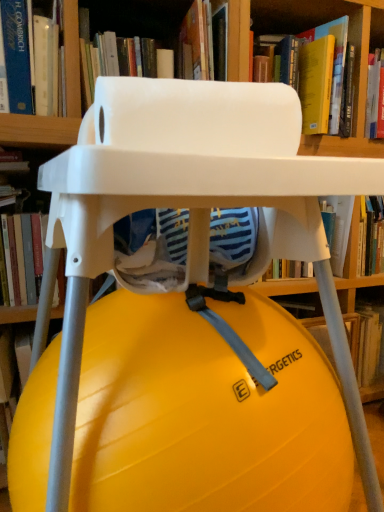
What is the approximate width of hardcover book at left, which is the first book in left-to-right order?

12.73 inches.

Where is `yellow matte exercise ball at center, the fifth book viewed from the left`? yellow matte exercise ball at center, the fifth book viewed from the left is located at coordinates (366, 344).

In order to face blue hardcover book at upper left, marked as the 4th book in a right-to-left arrangement, should I rotate leftwards or rightwards?

Rotate left and turn 21.204 degrees.

Locate an element on the screen. The height and width of the screenshot is (512, 384). blue hardcover book at upper left, which is counted as the second book, starting from the left is located at coordinates (30, 60).

What is the approximate height of yellow hardcover book at upper center, arranged as the 2th book when viewed from the right?

yellow hardcover book at upper center, arranged as the 2th book when viewed from the right, is 12.46 inches tall.

Locate an element on the screen. The height and width of the screenshot is (512, 384). hardcover book at left, which appears as the 5th book when viewed from the right is located at coordinates point(23,255).

Which point is more distant from viewer, (6, 155) or (341, 60)?

Positioned behind is point (341, 60).

Looking at their sizes, would you say hardcover book at left, which appears as the 5th book when viewed from the right, is wider or thinner than yellow hardcover book at upper center, arranged as the 2th book when viewed from the right?

Clearly, hardcover book at left, which appears as the 5th book when viewed from the right, has less width compared to yellow hardcover book at upper center, arranged as the 2th book when viewed from the right.

Considering the sizes of hardcover book at left, which appears as the 5th book when viewed from the right, and yellow hardcover book at upper center, arranged as the 2th book when viewed from the right, in the image, is hardcover book at left, which appears as the 5th book when viewed from the right, taller or shorter than yellow hardcover book at upper center, arranged as the 2th book when viewed from the right,?

hardcover book at left, which appears as the 5th book when viewed from the right, is shorter than yellow hardcover book at upper center, arranged as the 2th book when viewed from the right.

Consider the image. Is white matte book at upper center, the third book in the right-to-left sequence, taller than yellow rubber ball at center?

No, white matte book at upper center, the third book in the right-to-left sequence, is not taller than yellow rubber ball at center.

Find the location of a particular element. The height and width of the screenshot is (512, 384). ball located underneath the white matte book at upper center, which ranks as the 3th book in left-to-right order (from a real-world perspective) is located at coordinates (205, 412).

Which is behind, point (90, 16) or point (124, 510)?

Point (90, 16)

Is hardcover book at left, which appears as the 5th book when viewed from the right, not within blue hardcover book at upper left, which is counted as the second book, starting from the left?

Absolutely, hardcover book at left, which appears as the 5th book when viewed from the right, is external to blue hardcover book at upper left, which is counted as the second book, starting from the left.

Is hardcover book at left, which is the first book in left-to-right order, next to blue hardcover book at upper left, which is counted as the second book, starting from the left?

No, hardcover book at left, which is the first book in left-to-right order, is not with blue hardcover book at upper left, which is counted as the second book, starting from the left.

From the image's perspective, is yellow rubber ball at center above or below blue hardcover book at upper left, which is counted as the second book, starting from the left?

yellow rubber ball at center is situated lower than blue hardcover book at upper left, which is counted as the second book, starting from the left, in the image.

Does yellow rubber ball at center come in front of blue hardcover book at upper left, marked as the 4th book in a right-to-left arrangement?

Yes, yellow rubber ball at center is closer to the camera.

Could you tell me if yellow rubber ball at center is facing blue hardcover book at upper left, marked as the 4th book in a right-to-left arrangement?

No, yellow rubber ball at center is not aimed at blue hardcover book at upper left, marked as the 4th book in a right-to-left arrangement.

Is yellow rubber ball at center placed right next to blue hardcover book at upper left, which is counted as the second book, starting from the left?

yellow rubber ball at center is not next to blue hardcover book at upper left, which is counted as the second book, starting from the left, and they're not touching.

How different are the orientations of white matte book at upper center, which ranks as the 3th book in left-to-right order, and blue hardcover book at upper left, which is counted as the second book, starting from the left, in degrees?

The angular difference between white matte book at upper center, which ranks as the 3th book in left-to-right order, and blue hardcover book at upper left, which is counted as the second book, starting from the left, is 0.00073 degrees.

From a real-world perspective, relative to blue hardcover book at upper left, marked as the 4th book in a right-to-left arrangement, is white matte book at upper center, the third book in the right-to-left sequence, vertically above or below?

Clearly, from a real-world perspective, white matte book at upper center, the third book in the right-to-left sequence, is above blue hardcover book at upper left, marked as the 4th book in a right-to-left arrangement.

Is white matte book at upper center, the third book in the right-to-left sequence, aimed at blue hardcover book at upper left, which is counted as the second book, starting from the left?

No, white matte book at upper center, the third book in the right-to-left sequence, is not turned towards blue hardcover book at upper left, which is counted as the second book, starting from the left.

Considering the relative positions of yellow rubber ball at center and white matte book at upper center, which ranks as the 3th book in left-to-right order, in the image provided, is yellow rubber ball at center to the right of white matte book at upper center, which ranks as the 3th book in left-to-right order, from the viewer's perspective?

Correct, you'll find yellow rubber ball at center to the right of white matte book at upper center, which ranks as the 3th book in left-to-right order.

Would you say yellow rubber ball at center is inside or outside white matte book at upper center, which ranks as the 3th book in left-to-right order?

yellow rubber ball at center exists outside the volume of white matte book at upper center, which ranks as the 3th book in left-to-right order.

Relative to white matte book at upper center, the third book in the right-to-left sequence, is yellow rubber ball at center in front or behind?

Clearly, yellow rubber ball at center is in front of white matte book at upper center, the third book in the right-to-left sequence.

How many degrees apart are the facing directions of yellow rubber ball at center and white matte book at upper center, the third book in the right-to-left sequence?

The angular difference between yellow rubber ball at center and white matte book at upper center, the third book in the right-to-left sequence, is 90 degrees.

In the scene shown: Is white matte book at upper center, which ranks as the 3th book in left-to-right order, wider than hardcover book at left, which is the first book in left-to-right order?

Yes.

Can you confirm if white matte book at upper center, the third book in the right-to-left sequence, is smaller than hardcover book at left, which appears as the 5th book when viewed from the right?

Incorrect, white matte book at upper center, the third book in the right-to-left sequence, is not smaller in size than hardcover book at left, which appears as the 5th book when viewed from the right.

From the picture: How different are the orientations of white matte book at upper center, which ranks as the 3th book in left-to-right order, and hardcover book at left, which is the first book in left-to-right order, in degrees?

white matte book at upper center, which ranks as the 3th book in left-to-right order, and hardcover book at left, which is the first book in left-to-right order, are facing 0.000919 degrees away from each other.

In the image, is white matte book at upper center, which ranks as the 3th book in left-to-right order, positioned in front of or behind hardcover book at left, which is the first book in left-to-right order?

In the image, white matte book at upper center, which ranks as the 3th book in left-to-right order, appears in front of hardcover book at left, which is the first book in left-to-right order.

The image size is (384, 512). I want to click on book that is the 1st object directly below the yellow hardcover book at upper center, arranged as the fourth book when viewed from the left (from a real-world perspective), so click(23, 255).

Find the location of a particular element. This screenshot has height=512, width=384. ball in front of the white matte book at upper center, the third book in the right-to-left sequence is located at coordinates (205, 412).

In the scene shown: Which object lies further to the anchor point yellow rubber ball at center, yellow matte exercise ball at center, the fifth book viewed from the left, or blue hardcover book at upper left, which is counted as the second book, starting from the left?

The object further to yellow rubber ball at center is blue hardcover book at upper left, which is counted as the second book, starting from the left.

Looking at the image, which one is located closer to white matte book at upper center, the third book in the right-to-left sequence, blue hardcover book at upper left, which is counted as the second book, starting from the left, or yellow matte exercise ball at center, the fifth book viewed from the left?

blue hardcover book at upper left, which is counted as the second book, starting from the left, lies closer to white matte book at upper center, the third book in the right-to-left sequence, than the other object.

Looking at the image, which one is located further to yellow matte exercise ball at center, acting as the first book starting from the right, yellow rubber ball at center or yellow hardcover book at upper center, arranged as the fourth book when viewed from the left?

The object further to yellow matte exercise ball at center, acting as the first book starting from the right, is yellow hardcover book at upper center, arranged as the fourth book when viewed from the left.

Estimate the real-world distances between objects in this image. Which object is closer to white matte book at upper center, the third book in the right-to-left sequence, hardcover book at left, which is the first book in left-to-right order, or yellow hardcover book at upper center, arranged as the fourth book when viewed from the left?

yellow hardcover book at upper center, arranged as the fourth book when viewed from the left, lies closer to white matte book at upper center, the third book in the right-to-left sequence, than the other object.

When comparing their distances from yellow hardcover book at upper center, arranged as the fourth book when viewed from the left, does hardcover book at left, which is the first book in left-to-right order, or blue hardcover book at upper left, which is counted as the second book, starting from the left, seem closer?

The object closer to yellow hardcover book at upper center, arranged as the fourth book when viewed from the left, is blue hardcover book at upper left, which is counted as the second book, starting from the left.

Looking at the image, which one is located closer to yellow hardcover book at upper center, arranged as the 2th book when viewed from the right, white matte book at upper center, which ranks as the 3th book in left-to-right order, or yellow matte exercise ball at center, the fifth book viewed from the left?

white matte book at upper center, which ranks as the 3th book in left-to-right order, lies closer to yellow hardcover book at upper center, arranged as the 2th book when viewed from the right, than the other object.

From the image, which object appears to be farther from yellow matte exercise ball at center, the fifth book viewed from the left, blue hardcover book at upper left, marked as the 4th book in a right-to-left arrangement, or hardcover book at left, which is the first book in left-to-right order?

Based on the image, blue hardcover book at upper left, marked as the 4th book in a right-to-left arrangement, appears to be further to yellow matte exercise ball at center, the fifth book viewed from the left.

Looking at the image, which one is located further to yellow hardcover book at upper center, arranged as the 2th book when viewed from the right, blue hardcover book at upper left, marked as the 4th book in a right-to-left arrangement, or hardcover book at left, which appears as the 5th book when viewed from the right?

The object further to yellow hardcover book at upper center, arranged as the 2th book when viewed from the right, is hardcover book at left, which appears as the 5th book when viewed from the right.

Locate an element on the screen. book between blue hardcover book at upper left, marked as the 4th book in a right-to-left arrangement, and yellow rubber ball at center from top to bottom is located at coordinates pos(23,255).

Where is `book between white matte book at upper center, the third book in the right-to-left sequence, and hardcover book at left, which appears as the 5th book when viewed from the right, from top to bottom`? book between white matte book at upper center, the third book in the right-to-left sequence, and hardcover book at left, which appears as the 5th book when viewed from the right, from top to bottom is located at coordinates coord(30,60).

You are a GUI agent. You are given a task and a screenshot of the screen. Output one action in this format:
    pyautogui.click(x=<x>, y=<y>)
    Task: Click on the book between blue hardcover book at upper left, marked as the 4th book in a right-to-left arrangement, and yellow hardcover book at upper center, arranged as the 2th book when viewed from the right, from left to right
    This screenshot has width=384, height=512.
    Given the screenshot: What is the action you would take?
    pyautogui.click(x=138, y=17)

Find the location of a particular element. Image resolution: width=384 pixels, height=512 pixels. ball between hardcover book at left, which is the first book in left-to-right order, and yellow matte exercise ball at center, the fifth book viewed from the left is located at coordinates (205, 412).